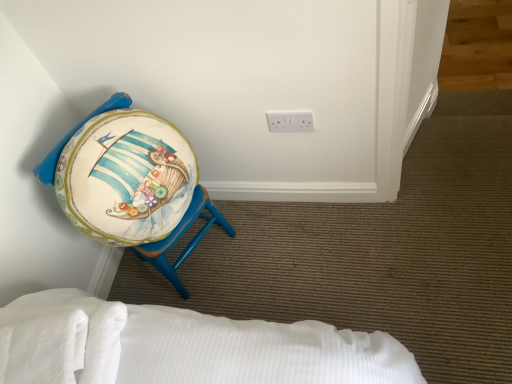
Locate an element on the screen. blank space above matte painted stool at left (from a real-world perspective) is located at coordinates (94, 139).